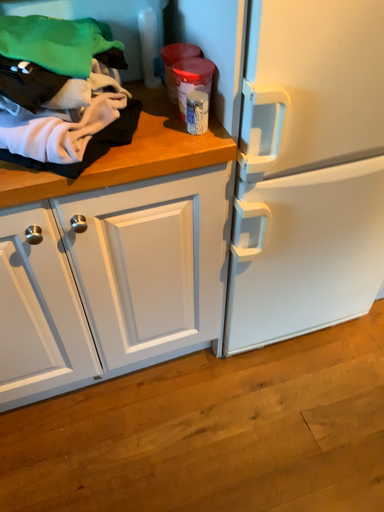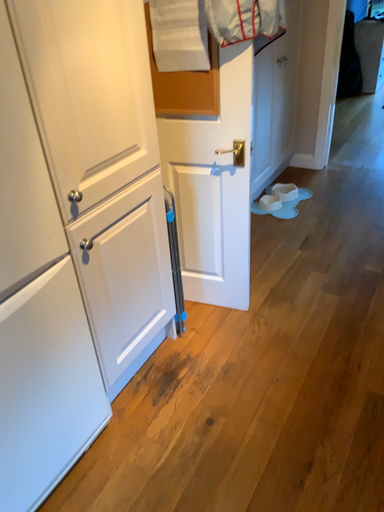
Question: Which way did the camera rotate in the video?

Choices:
 (A) rotated right
 (B) rotated left

Answer: (A)